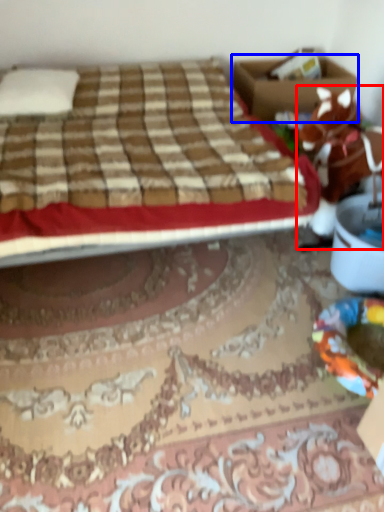
Question: Which object is further to the camera taking this photo, animal (highlighted by a red box) or box (highlighted by a blue box)?

Choices:
 (A) animal
 (B) box

Answer: (B)